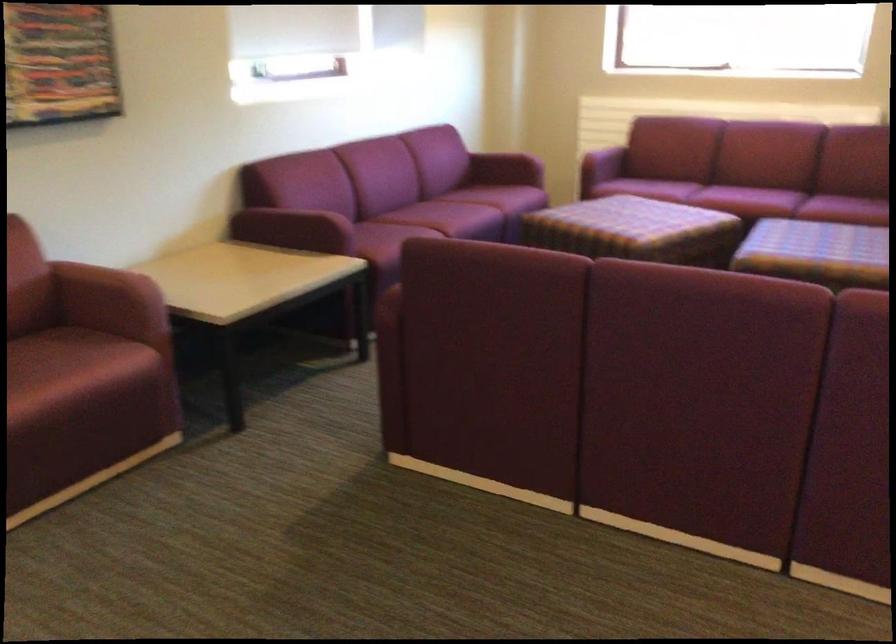
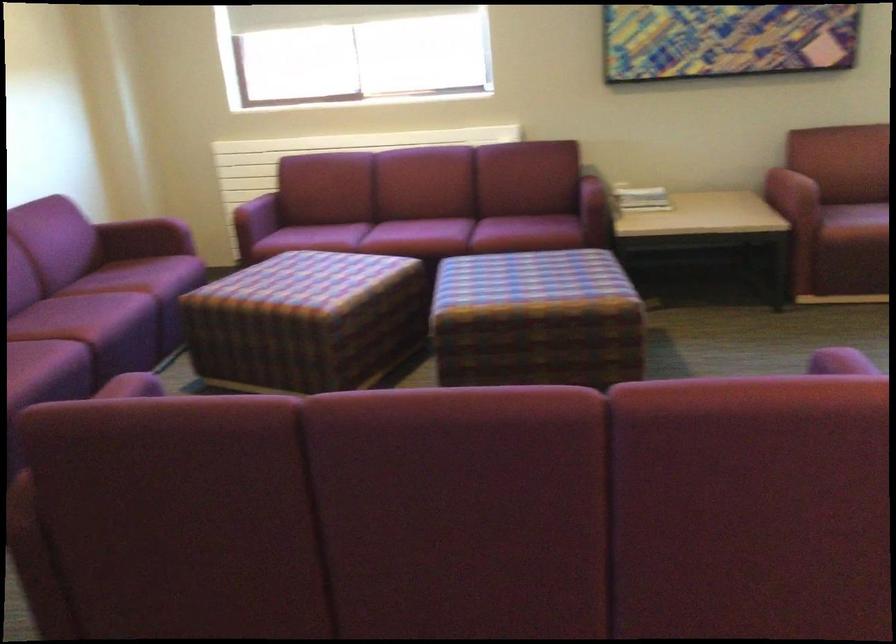
The point at (770, 202) is marked in the first image. Where is the corresponding point in the second image?

(445, 236)